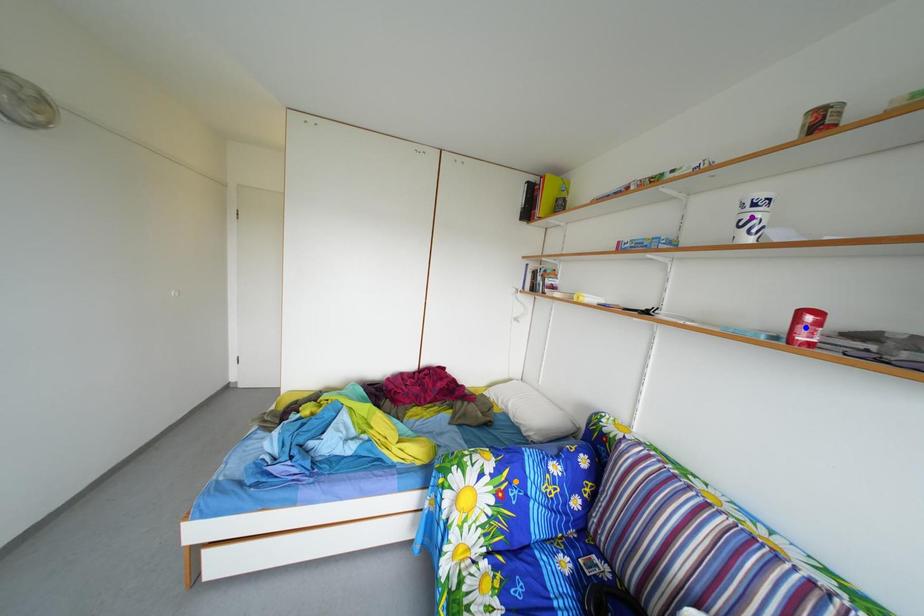
Order these from farthest to nearest:
purple point
blue point
orange point

orange point → purple point → blue point